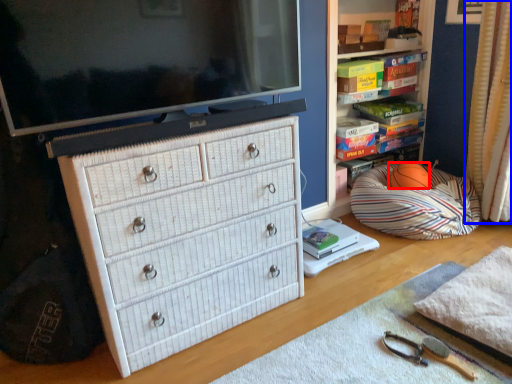
Question: Which point is further to the camera, ball (highlighted by a red box) or curtain (highlighted by a blue box)?

Choices:
 (A) ball
 (B) curtain

Answer: (A)